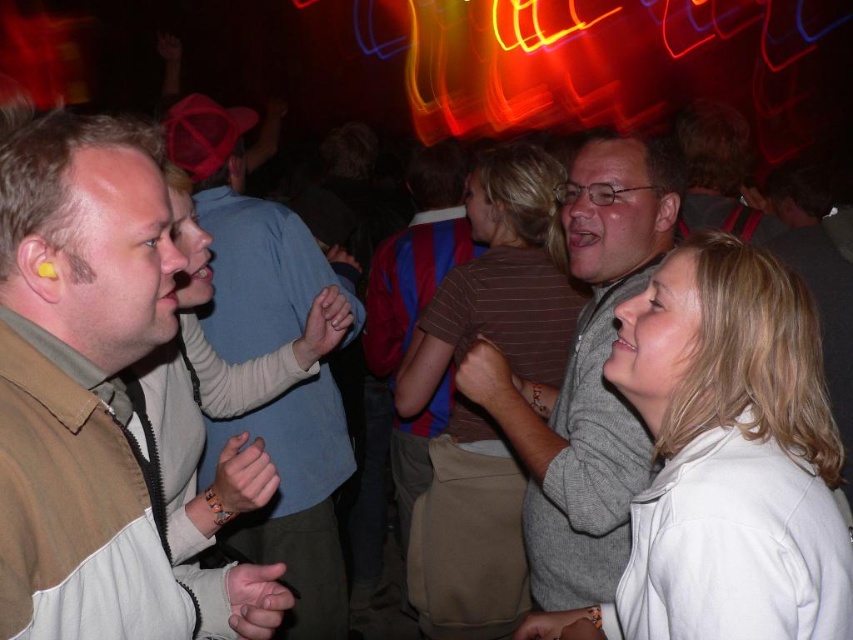
You are at a party and want to find the white matte jacket at center. There is a point marked at coordinates (730, 454) in the image. Is this point located on the white matte jacket at center?

Yes, the point marked at coordinates (730, 454) is located on the white matte jacket at center according to the description.

You are at the party and want to approach both the gray sweater at center and the matte gray shirt at center. Which one should you walk towards first to reach the one closer to you?

You should walk towards the gray sweater at center first because it is closer to the viewer than the matte gray shirt at center.